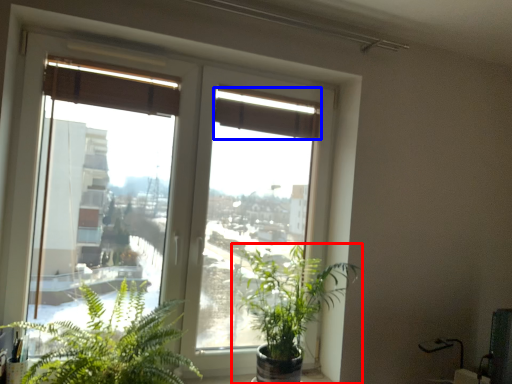
Question: Which of the following is the closest to the observer, houseplant (highlighted by a red box) or curtain (highlighted by a blue box)?

Choices:
 (A) houseplant
 (B) curtain

Answer: (A)